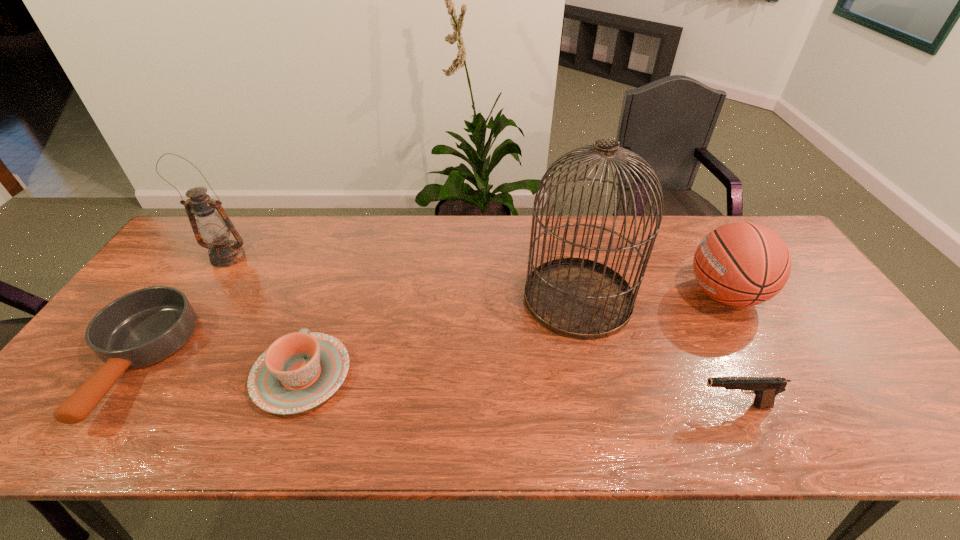
I want to click on vacant space at the right edge, so click(x=849, y=389).

The image size is (960, 540). What are the coordinates of `unoccupied area between the fourth object from right to left and the oil lamp` in the screenshot? It's located at (265, 316).

Find the location of a particular element. free space between the oil lamp and the fourth object from left to right is located at coordinates (403, 278).

What are the coordinates of `empty space between the basketball and the pan` in the screenshot? It's located at (429, 328).

Where is `vacant point located between the oil lamp and the fourth shortest object`? The height and width of the screenshot is (540, 960). vacant point located between the oil lamp and the fourth shortest object is located at coordinates (476, 275).

Identify the location of vacant area that lies between the pistol and the pan. (434, 384).

The height and width of the screenshot is (540, 960). In order to click on free space between the tallest object and the basketball in this screenshot , I will do `click(651, 296)`.

This screenshot has height=540, width=960. I want to click on vacant space that's between the basketball and the pan, so click(x=429, y=328).

Find the location of a particular element. Image resolution: width=960 pixels, height=540 pixels. vacant area between the third tallest object and the pan is located at coordinates (429, 328).

This screenshot has height=540, width=960. I want to click on vacant region between the pistol and the pan, so tap(434, 384).